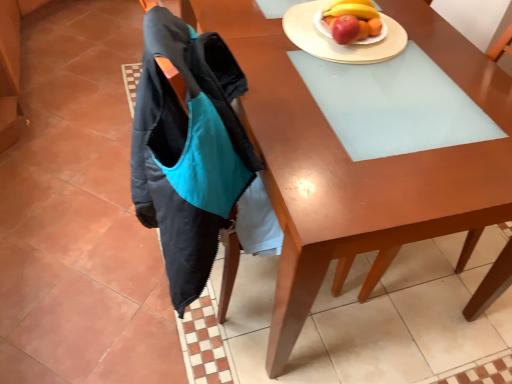
Image resolution: width=512 pixels, height=384 pixels. What are the coordinates of `wooden plate at upper right, the second plate when ordered from right to left` in the screenshot? It's located at (335, 42).

The height and width of the screenshot is (384, 512). What do you see at coordinates (358, 162) in the screenshot?
I see `wooden desk at center` at bounding box center [358, 162].

Find the location of a particular element. wooden plate at upper right, the second plate when ordered from right to left is located at coordinates (335, 42).

Where is `desk in front of the wooden plate at upper right, the second plate when ordered from right to left`? This screenshot has width=512, height=384. desk in front of the wooden plate at upper right, the second plate when ordered from right to left is located at coordinates (358, 162).

Can you confirm if wooden desk at center is bigger than wooden plate at upper right, the second plate when ordered from right to left?

Yes.

From the image's perspective, who appears lower, wooden desk at center or wooden plate at upper right, placed as the 1th plate when sorted from left to right?

From the image's view, wooden desk at center is below.

Does point (439, 232) come farther from viewer compared to point (287, 34)?

No, it is in front of (287, 34).

Based on the photo, from a real-world perspective, is wooden desk at center positioned above or below matte wood chair at upper right?

wooden desk at center is below matte wood chair at upper right.

In the scene shown: Is wooden desk at center positioned behind matte wood chair at upper right?

No.

From the picture: Is wooden desk at center facing towards matte wood chair at upper right?

Yes, wooden desk at center faces towards matte wood chair at upper right.

From the image's perspective, is wooden desk at center on matte wood chair at upper right?

Yes, from the image's perspective, wooden desk at center is on top of matte wood chair at upper right.

How many degrees apart are the facing directions of white glossy plate at upper right, arranged as the second plate when viewed from the left, and wooden plate at upper right, placed as the 1th plate when sorted from left to right?

180 degrees.

Could you tell me if white glossy plate at upper right, arranged as the second plate when viewed from the left, is facing wooden plate at upper right, the second plate when ordered from right to left?

No, white glossy plate at upper right, arranged as the second plate when viewed from the left, is not aimed at wooden plate at upper right, the second plate when ordered from right to left.

Are white glossy plate at upper right, which is counted as the first plate, starting from the right, and wooden plate at upper right, placed as the 1th plate when sorted from left to right, far apart?

white glossy plate at upper right, which is counted as the first plate, starting from the right, is near wooden plate at upper right, placed as the 1th plate when sorted from left to right, not far away.

Measure the distance between white glossy plate at upper right, arranged as the second plate when viewed from the left, and wooden plate at upper right, the second plate when ordered from right to left.

A distance of 1.81 inches exists between white glossy plate at upper right, arranged as the second plate when viewed from the left, and wooden plate at upper right, the second plate when ordered from right to left.

Which is in front, point (454, 204) or point (316, 22)?

The point (454, 204) is in front.

Do you think matte wood chair at upper right is within white glossy plate at upper right, arranged as the second plate when viewed from the left, or outside of it?

matte wood chair at upper right is located beyond the bounds of white glossy plate at upper right, arranged as the second plate when viewed from the left.

Is matte wood chair at upper right at the right side of white glossy plate at upper right, which is counted as the first plate, starting from the right?

Indeed, matte wood chair at upper right is positioned on the right side of white glossy plate at upper right, which is counted as the first plate, starting from the right.

How different are the orientations of matte wood chair at upper right and white glossy plate at upper right, which is counted as the first plate, starting from the right, in degrees?

There is a 180-degree angle between the facing directions of matte wood chair at upper right and white glossy plate at upper right, which is counted as the first plate, starting from the right.

From the image's perspective, relative to matte wood chair at upper right, is wooden plate at upper right, the second plate when ordered from right to left, above or below?

From the image's perspective, wooden plate at upper right, the second plate when ordered from right to left, appears above matte wood chair at upper right.

Is wooden plate at upper right, the second plate when ordered from right to left, not within matte wood chair at upper right?

wooden plate at upper right, the second plate when ordered from right to left, lies outside matte wood chair at upper right's area.

Consider the image. Does wooden plate at upper right, placed as the 1th plate when sorted from left to right, have a smaller size compared to matte wood chair at upper right?

Correct, wooden plate at upper right, placed as the 1th plate when sorted from left to right, occupies less space than matte wood chair at upper right.

What are the coordinates of `chair below the wooden plate at upper right, placed as the 1th plate when sorted from left to right (from a real-world perspective)` in the screenshot? It's located at (423, 166).

Which object is closer to the camera taking this photo, matte wood chair at upper right or wooden plate at upper right, placed as the 1th plate when sorted from left to right?

matte wood chair at upper right is in front.

Which is more to the right, matte wood chair at upper right or wooden plate at upper right, the second plate when ordered from right to left?

From the viewer's perspective, matte wood chair at upper right appears more on the right side.

Can you confirm if matte wood chair at upper right is thinner than wooden plate at upper right, placed as the 1th plate when sorted from left to right?

No, matte wood chair at upper right is not thinner than wooden plate at upper right, placed as the 1th plate when sorted from left to right.

Is white glossy plate at upper right, arranged as the second plate when viewed from the left, with wooden desk at center?

No, white glossy plate at upper right, arranged as the second plate when viewed from the left, is not touching wooden desk at center.

In terms of width, does white glossy plate at upper right, arranged as the second plate when viewed from the left, look wider or thinner when compared to wooden desk at center?

Answer: In the image, white glossy plate at upper right, arranged as the second plate when viewed from the left, appears to be more narrow than wooden desk at center.

From the image's perspective, is white glossy plate at upper right, which is counted as the first plate, starting from the right, on top of wooden desk at center?

Yes, from the image's perspective, white glossy plate at upper right, which is counted as the first plate, starting from the right, is above wooden desk at center.

Locate an element on the screen. desk below the wooden plate at upper right, the second plate when ordered from right to left (from the image's perspective) is located at coordinates (358, 162).

Where is `desk located on the left of matte wood chair at upper right`? Image resolution: width=512 pixels, height=384 pixels. desk located on the left of matte wood chair at upper right is located at coordinates (358, 162).

Looking at the image, which one is located closer to wooden plate at upper right, placed as the 1th plate when sorted from left to right, wooden desk at center or matte wood chair at upper right?

wooden desk at center lies closer to wooden plate at upper right, placed as the 1th plate when sorted from left to right, than the other object.

Based on their spatial positions, is wooden desk at center or wooden plate at upper right, placed as the 1th plate when sorted from left to right, closer to white glossy plate at upper right, arranged as the second plate when viewed from the left?

Based on the image, wooden plate at upper right, placed as the 1th plate when sorted from left to right, appears to be nearer to white glossy plate at upper right, arranged as the second plate when viewed from the left.

Looking at the image, which one is located further to white glossy plate at upper right, arranged as the second plate when viewed from the left, wooden plate at upper right, placed as the 1th plate when sorted from left to right, or matte wood chair at upper right?

Based on the image, matte wood chair at upper right appears to be further to white glossy plate at upper right, arranged as the second plate when viewed from the left.

Estimate the real-world distances between objects in this image. Which object is closer to wooden plate at upper right, the second plate when ordered from right to left, wooden desk at center or white glossy plate at upper right, which is counted as the first plate, starting from the right?

The object closer to wooden plate at upper right, the second plate when ordered from right to left, is white glossy plate at upper right, which is counted as the first plate, starting from the right.

Estimate the real-world distances between objects in this image. Which object is further from matte wood chair at upper right, wooden plate at upper right, placed as the 1th plate when sorted from left to right, or white glossy plate at upper right, arranged as the second plate when viewed from the left?

white glossy plate at upper right, arranged as the second plate when viewed from the left, lies further to matte wood chair at upper right than the other object.

Which object lies nearer to the anchor point matte wood chair at upper right, wooden plate at upper right, placed as the 1th plate when sorted from left to right, or wooden desk at center?

wooden desk at center.

When comparing their distances from wooden desk at center, does matte wood chair at upper right or white glossy plate at upper right, arranged as the second plate when viewed from the left, seem further?

Based on the image, white glossy plate at upper right, arranged as the second plate when viewed from the left, appears to be further to wooden desk at center.

When comparing their distances from white glossy plate at upper right, arranged as the second plate when viewed from the left, does wooden desk at center or matte wood chair at upper right seem closer?

matte wood chair at upper right is closer to white glossy plate at upper right, arranged as the second plate when viewed from the left.

The image size is (512, 384). I want to click on plate between wooden desk at center and white glossy plate at upper right, arranged as the second plate when viewed from the left, in the front-back direction, so click(x=335, y=42).

This screenshot has height=384, width=512. In order to click on chair between wooden desk at center and white glossy plate at upper right, which is counted as the first plate, starting from the right, along the z-axis in this screenshot , I will do `click(423, 166)`.

This screenshot has width=512, height=384. In order to click on chair between wooden desk at center and wooden plate at upper right, placed as the 1th plate when sorted from left to right, along the z-axis in this screenshot , I will do `click(423, 166)`.

Identify the location of plate that lies between white glossy plate at upper right, arranged as the second plate when viewed from the left, and matte wood chair at upper right from top to bottom. The width and height of the screenshot is (512, 384). (335, 42).